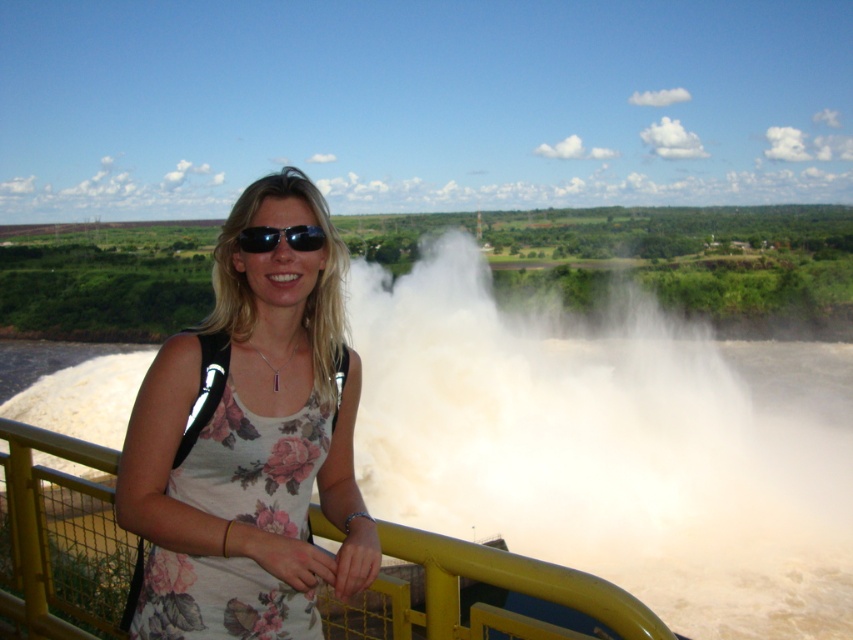
Can you confirm if floral fabric dress at center is shorter than yellow metal railing at center?

Correct, floral fabric dress at center is not as tall as yellow metal railing at center.

What do you see at coordinates (248, 442) in the screenshot? The width and height of the screenshot is (853, 640). I see `floral fabric dress at center` at bounding box center [248, 442].

Locate an element on the screen. floral fabric dress at center is located at coordinates (248, 442).

The image size is (853, 640). What do you see at coordinates (611, 445) in the screenshot? I see `white frothy water at center` at bounding box center [611, 445].

Does point (486, 324) lie behind point (273, 237)?

Yes, it is.

The width and height of the screenshot is (853, 640). I want to click on white frothy water at center, so click(x=611, y=445).

Is point (457, 529) positioned after point (325, 432)?

That is True.

Measure the distance from white frothy water at center to floral fabric dress at center.

white frothy water at center and floral fabric dress at center are 27.65 meters apart from each other.

Which is behind, point (607, 380) or point (236, 396)?

Positioned behind is point (607, 380).

Where is `white frothy water at center`? The width and height of the screenshot is (853, 640). white frothy water at center is located at coordinates (611, 445).